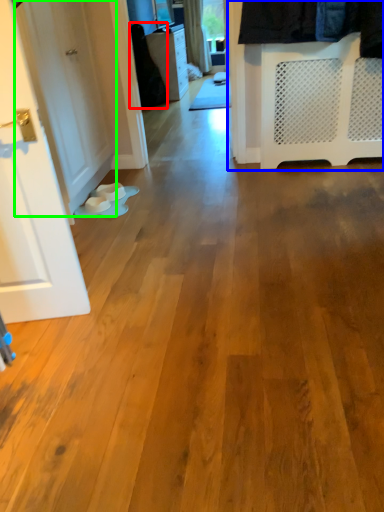
Question: Which object is the farthest from clothing (highlighted by a red box)? Choose among these: closet (highlighted by a blue box) or door (highlighted by a green box).

Choices:
 (A) closet
 (B) door

Answer: (A)